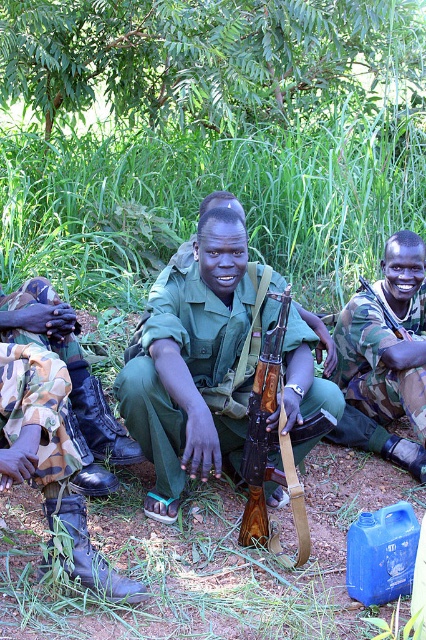
Question: Does green leafy tree at upper center appear under camouflage fabric uniform at lower right?

Choices:
 (A) no
 (B) yes

Answer: (A)

Question: Among these points, which one is farthest from the camera?

Choices:
 (A) (43, 396)
 (B) (264, 502)

Answer: (B)

Question: Can you confirm if green matte uniform at center is thinner than camouflage fabric uniform at lower right?

Choices:
 (A) no
 (B) yes

Answer: (A)

Question: Considering the real-world distances, which object is farthest from the black leather boots at lower left?

Choices:
 (A) camouflage fabric uniform at lower right
 (B) green matte uniform at center
 (C) wooden rifle at center

Answer: (A)

Question: Among these points, which one is farthest from the camera?

Choices:
 (A) (17, 480)
 (B) (374, 332)
 (C) (77, 4)

Answer: (C)

Question: From the image, what is the correct spatial relationship of black leather boots at lower left in relation to camouflage fabric uniform at lower right?

Choices:
 (A) above
 (B) below

Answer: (B)